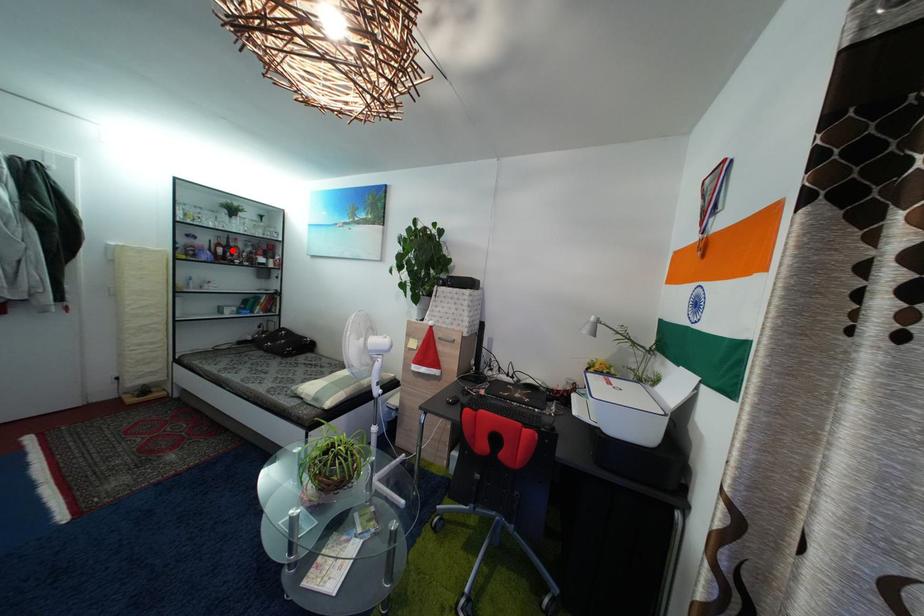
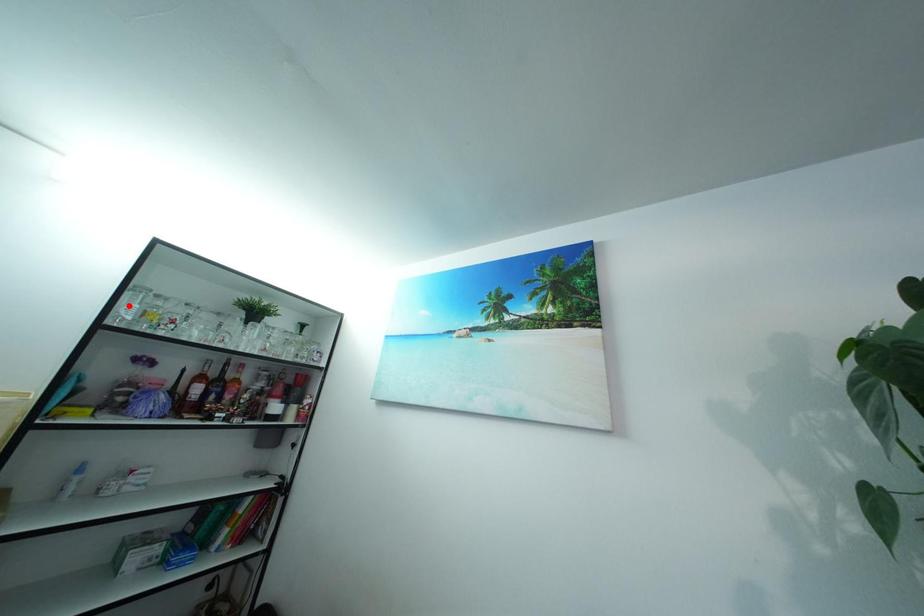
I am providing you with two images of the same scene from different viewpoints. A red point is marked on the first image and another point is marked on the second image. Do the highlighted points in image1 and image2 indicate the same real-world spot?

No